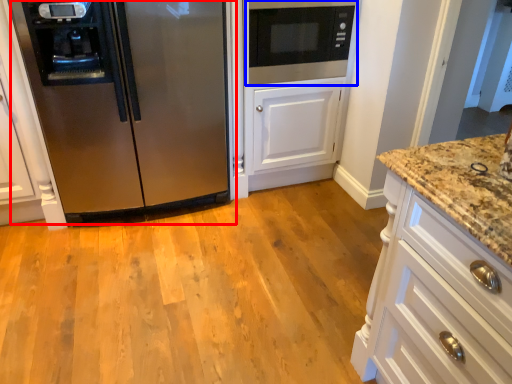
Question: Which object is further to the camera taking this photo, refrigerator (highlighted by a red box) or microwave oven (highlighted by a blue box)?

Choices:
 (A) refrigerator
 (B) microwave oven

Answer: (B)